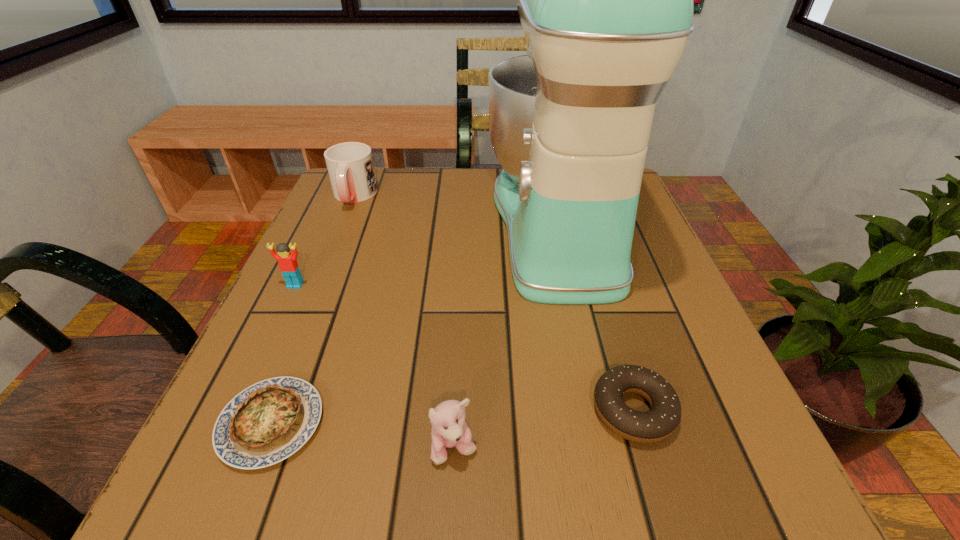
Locate an element on the screen. The image size is (960, 540). vacant space located 0.350m on the face of the Lego is located at coordinates (204, 477).

The width and height of the screenshot is (960, 540). What are the coordinates of `vacant space located 0.070m on the front of the fifth tallest object` in the screenshot? It's located at (661, 504).

Find the location of a particular element. Image resolution: width=960 pixels, height=540 pixels. vacant space located on the right of the quiche is located at coordinates [474, 423].

Find the location of `mixer that is at the far edge`. mixer that is at the far edge is located at coordinates (605, 0).

Image resolution: width=960 pixels, height=540 pixels. Find the location of `mug situated at the far edge`. mug situated at the far edge is located at coordinates (350, 166).

The width and height of the screenshot is (960, 540). In order to click on teddy bear situated at the near edge in this screenshot , I will do `click(449, 430)`.

The width and height of the screenshot is (960, 540). I want to click on doughnut that is at the near edge, so click(x=658, y=423).

Where is `quiche that is at the near edge`? quiche that is at the near edge is located at coordinates (269, 421).

At what (x,y) coordinates should I click in order to perform the action: click on mug that is at the left edge. Please return your answer as a coordinate pair (x, y). The image size is (960, 540). Looking at the image, I should click on (350, 166).

You are a GUI agent. You are given a task and a screenshot of the screen. Output one action in this format:
    pyautogui.click(x=<x>, y=<y>)
    Task: Click on the Lego positioned at the left edge
    
    Given the screenshot: What is the action you would take?
    pyautogui.click(x=288, y=265)